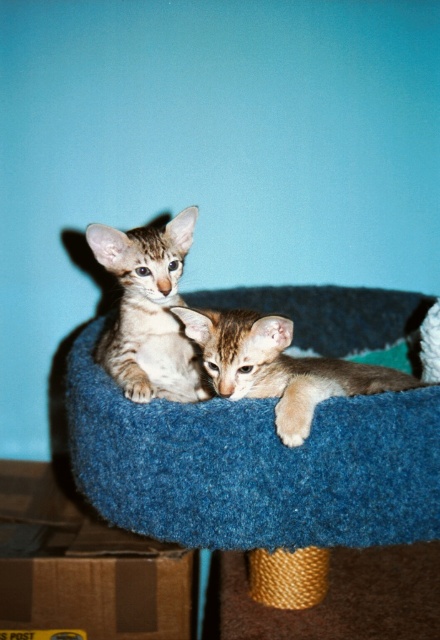
Question: Which of the following is the closest to the observer?

Choices:
 (A) blue felt cat bed at center
 (B) brown cardboard box at lower left
 (C) tabby fur kitten at center
 (D) light brown fur kitten at center

Answer: (C)

Question: Is the position of blue felt cat bed at center less distant than that of brown cardboard box at lower left?

Choices:
 (A) yes
 (B) no

Answer: (A)

Question: Which point is closer to the camera?

Choices:
 (A) blue felt cat bed at center
 (B) tabby fur kitten at center
 (C) brown cardboard box at lower left
 (D) light brown fur kitten at center

Answer: (B)

Question: Can you confirm if blue felt cat bed at center is wider than tabby fur kitten at center?

Choices:
 (A) no
 (B) yes

Answer: (B)

Question: Which object appears farthest from the camera in this image?

Choices:
 (A) brown cardboard box at lower left
 (B) tabby fur kitten at center
 (C) light brown fur kitten at center
 (D) blue felt cat bed at center

Answer: (A)

Question: In this image, where is blue felt cat bed at center located relative to brown cardboard box at lower left?

Choices:
 (A) above
 (B) below

Answer: (A)